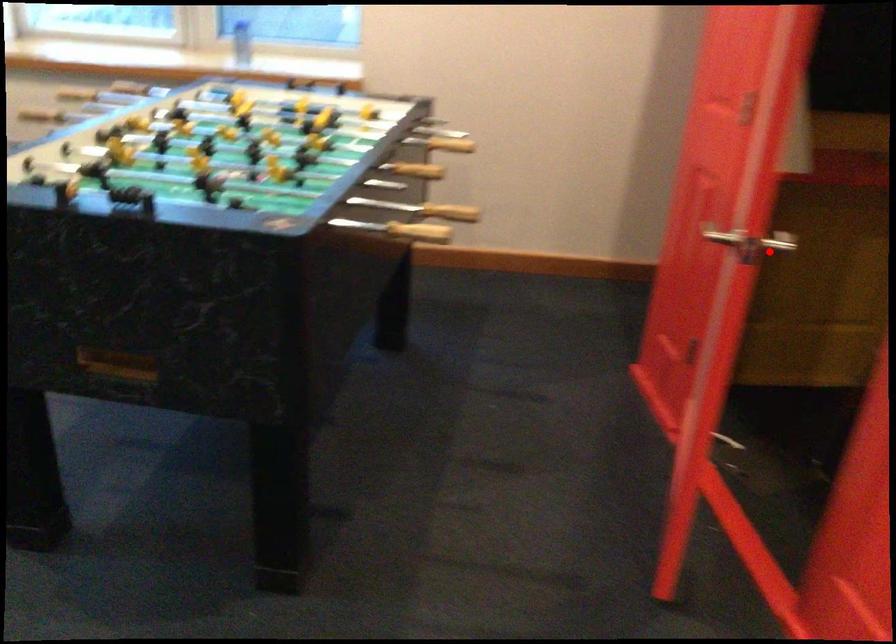
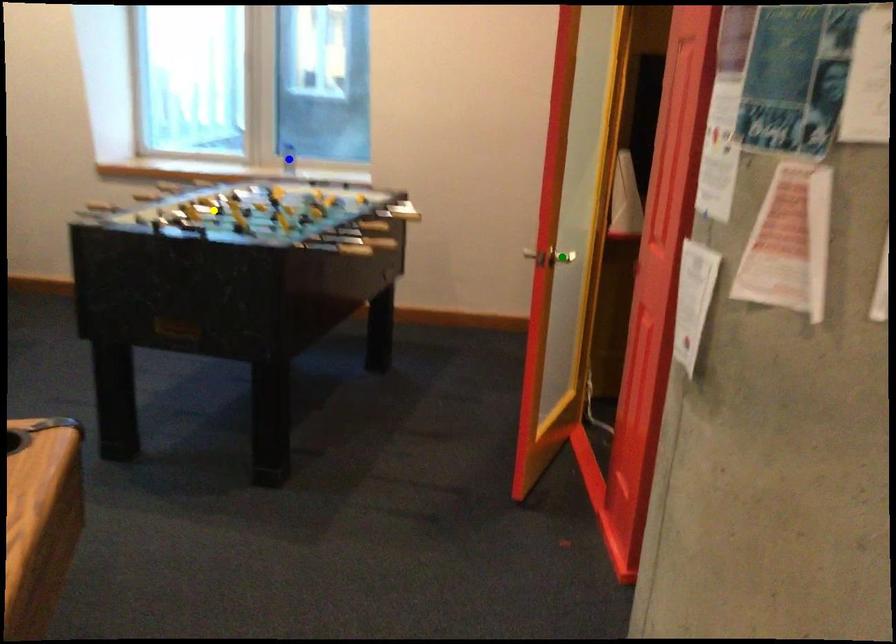
Question: I am providing you with two images of the same scene from different viewpoints. A red point is marked on the first image. You are given multiple points on the second image. Can you choose the point in image 2 that corresponds to the point in image 1?

Choices:
 (A) green point
 (B) yellow point
 (C) blue point

Answer: (A)